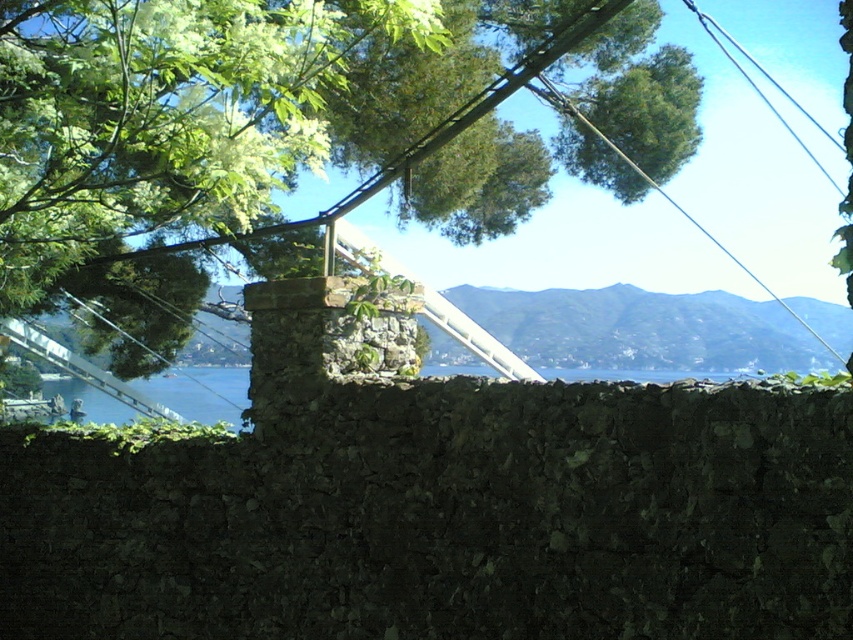
Is green leafy tree at upper left to the right of black wire at upper right from the viewer's perspective?

No, green leafy tree at upper left is not to the right of black wire at upper right.

Does point (32, 90) lie behind point (814, 124)?

No, it is in front of (814, 124).

You are a GUI agent. You are given a task and a screenshot of the screen. Output one action in this format:
    pyautogui.click(x=<x>, y=<y>)
    Task: Click on the green leafy tree at upper left
    This screenshot has width=853, height=640.
    Given the screenshot: What is the action you would take?
    pyautogui.click(x=225, y=113)